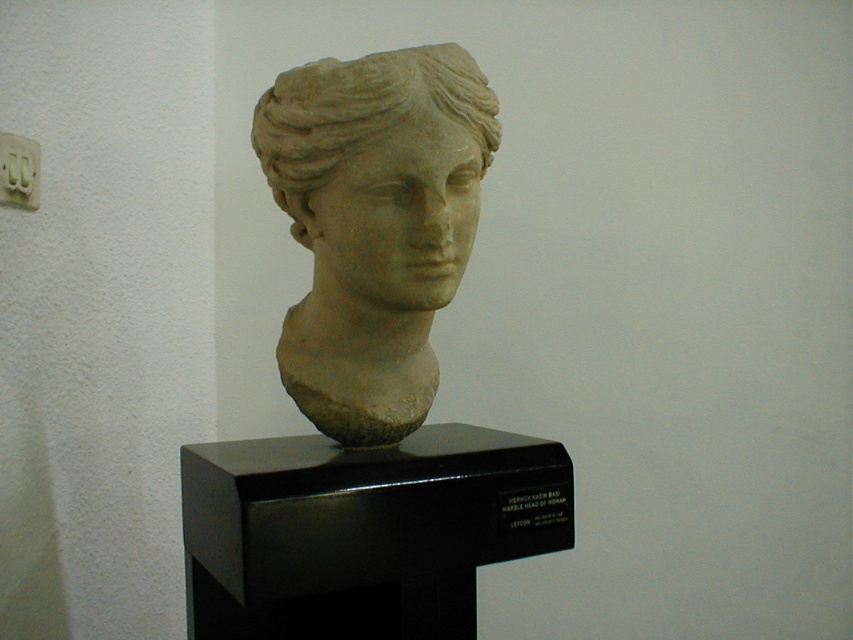
Question: Which point appears closest to the camera in this image?

Choices:
 (A) (283, 100)
 (B) (381, 72)

Answer: (B)

Question: Can you confirm if matte stone bust at center is bigger than white marble head at center?

Choices:
 (A) no
 (B) yes

Answer: (B)

Question: Which point is farther to the camera?

Choices:
 (A) matte stone bust at center
 (B) white marble head at center

Answer: (A)

Question: Is matte stone bust at center bigger than white marble head at center?

Choices:
 (A) yes
 (B) no

Answer: (A)

Question: Which point is farther from the camera taking this photo?

Choices:
 (A) (495, 134)
 (B) (347, 220)

Answer: (A)

Question: Can you confirm if matte stone bust at center is positioned to the left of white marble head at center?

Choices:
 (A) no
 (B) yes

Answer: (B)